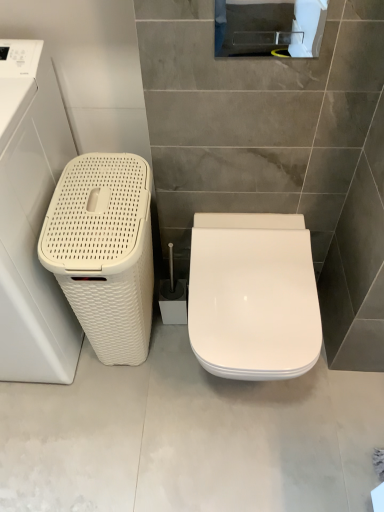
Question: Is white woven basket at left touching white glossy toilet seat at center?

Choices:
 (A) yes
 (B) no

Answer: (B)

Question: Could white glossy toilet seat at center be considered to be inside white woven basket at left?

Choices:
 (A) yes
 (B) no

Answer: (B)

Question: Is white woven basket at left at the right side of white glossy toilet seat at center?

Choices:
 (A) no
 (B) yes

Answer: (A)

Question: Considering the relative positions of white woven basket at left and white glossy toilet seat at center in the image provided, is white woven basket at left in front of white glossy toilet seat at center?

Choices:
 (A) no
 (B) yes

Answer: (B)

Question: Is white woven basket at left outside white glossy toilet seat at center?

Choices:
 (A) yes
 (B) no

Answer: (A)

Question: From the image's perspective, is white glossy toilet at center located above or below white woven basket at left?

Choices:
 (A) below
 (B) above

Answer: (A)

Question: Is white glossy toilet at center inside or outside of white woven basket at left?

Choices:
 (A) inside
 (B) outside

Answer: (B)

Question: In terms of width, does white glossy toilet at center look wider or thinner when compared to white woven basket at left?

Choices:
 (A) wide
 (B) thin

Answer: (A)

Question: In terms of height, does white glossy toilet at center look taller or shorter compared to white woven basket at left?

Choices:
 (A) tall
 (B) short

Answer: (B)

Question: Is white woven basket at left spatially inside white woven basket at left, or outside of it?

Choices:
 (A) outside
 (B) inside

Answer: (A)

Question: Considering their positions, is white woven basket at left located in front of or behind white woven basket at left?

Choices:
 (A) front
 (B) behind

Answer: (A)

Question: From a real-world perspective, relative to white woven basket at left, is white woven basket at left vertically above or below?

Choices:
 (A) above
 (B) below

Answer: (A)

Question: Is point (41, 345) positioned closer to the camera than point (125, 344)?

Choices:
 (A) closer
 (B) farther

Answer: (A)

Question: Considering the positions of white woven basket at left and white glossy toilet seat at center in the image, is white woven basket at left bigger or smaller than white glossy toilet seat at center?

Choices:
 (A) small
 (B) big

Answer: (B)

Question: In the image, is white woven basket at left on the left side or the right side of white glossy toilet seat at center?

Choices:
 (A) right
 (B) left

Answer: (B)